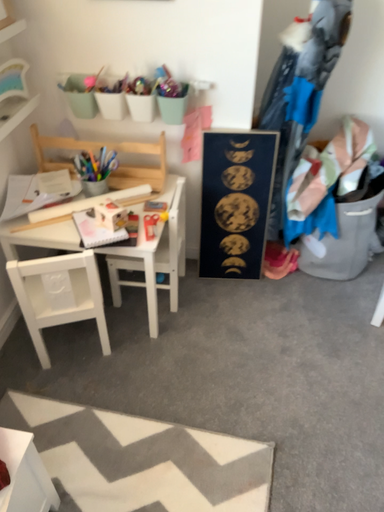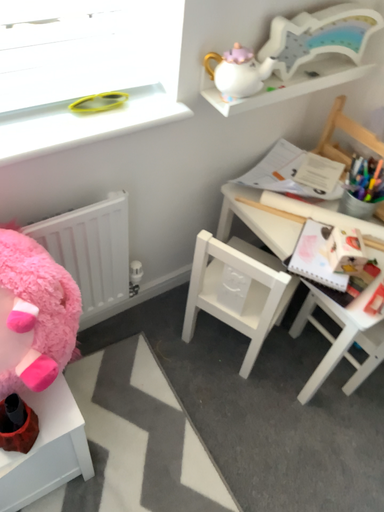
Question: How did the camera likely rotate when shooting the video?

Choices:
 (A) rotated right
 (B) rotated left

Answer: (B)